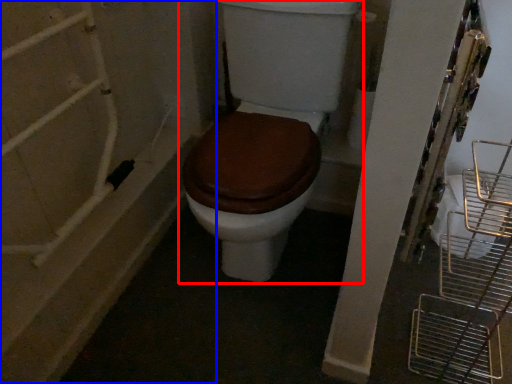
Question: Among these objects, which one is farthest to the camera, toilet (highlighted by a red box) or bath (highlighted by a blue box)?

Choices:
 (A) toilet
 (B) bath

Answer: (B)